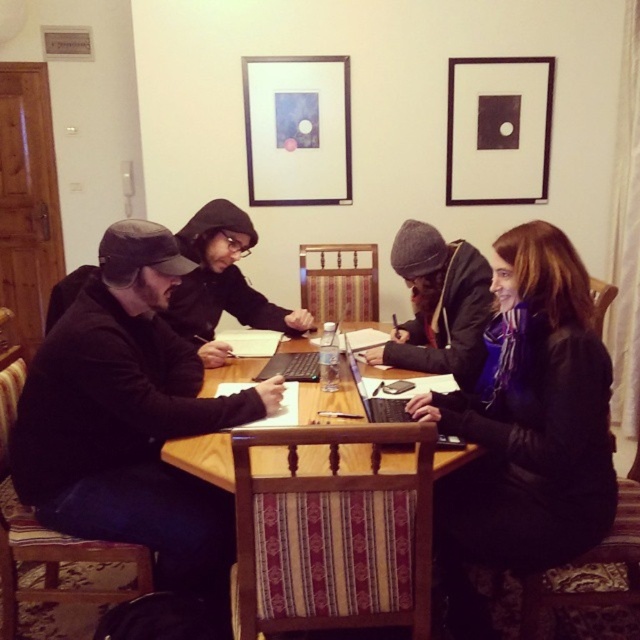
Question: Which point is closer to the camera taking this photo?

Choices:
 (A) (417, 605)
 (B) (374, 348)

Answer: (A)

Question: Can you confirm if matte glass picture frame at upper center is smaller than black matte laptop at center?

Choices:
 (A) no
 (B) yes

Answer: (A)

Question: Considering the real-world distances, which object is closest to the black matte picture frame at upper right?

Choices:
 (A) wooden table at center
 (B) matte black jacket at left
 (C) dark blue scarf at center
 (D) matte glass picture frame at upper center

Answer: (D)

Question: Does matte glass picture frame at upper center appear on the left side of black matte laptop at center?

Choices:
 (A) yes
 (B) no

Answer: (A)

Question: Can you confirm if matte black jacket at left is positioned to the right of black matte laptop at center?

Choices:
 (A) yes
 (B) no

Answer: (B)

Question: Which point is closer to the camera?

Choices:
 (A) (426, 294)
 (B) (493, 275)

Answer: (B)